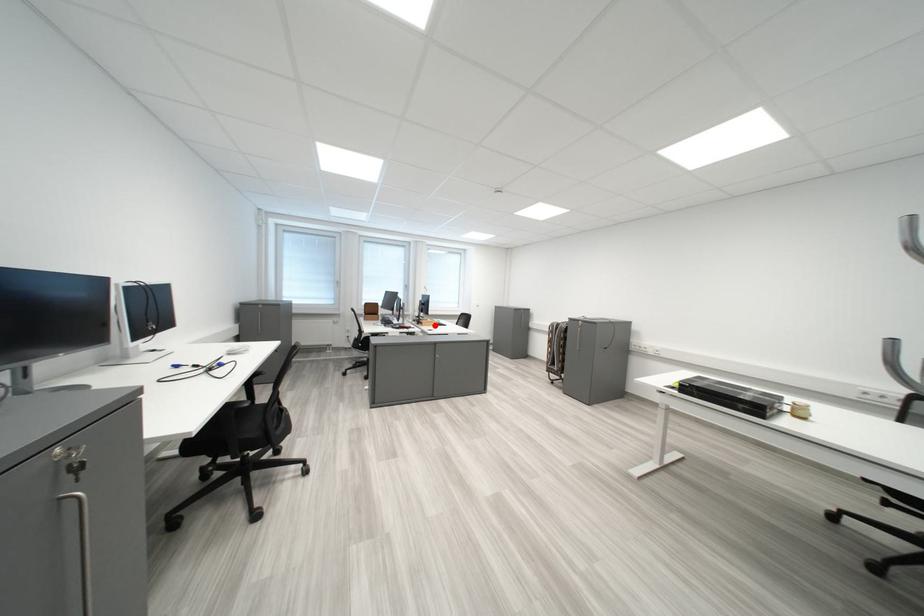
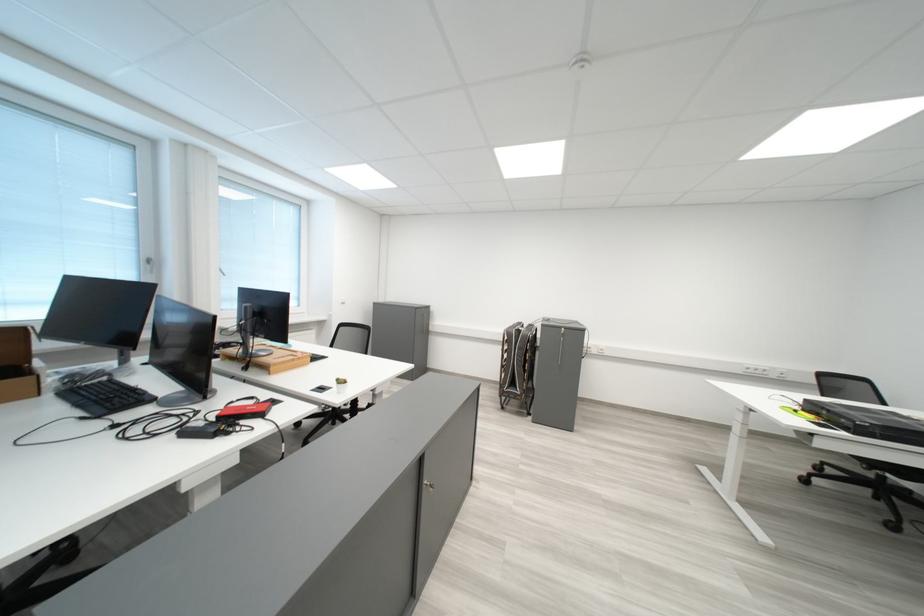
In the second image, find the point that corresponds to the highlighted location in the first image.

(277, 369)